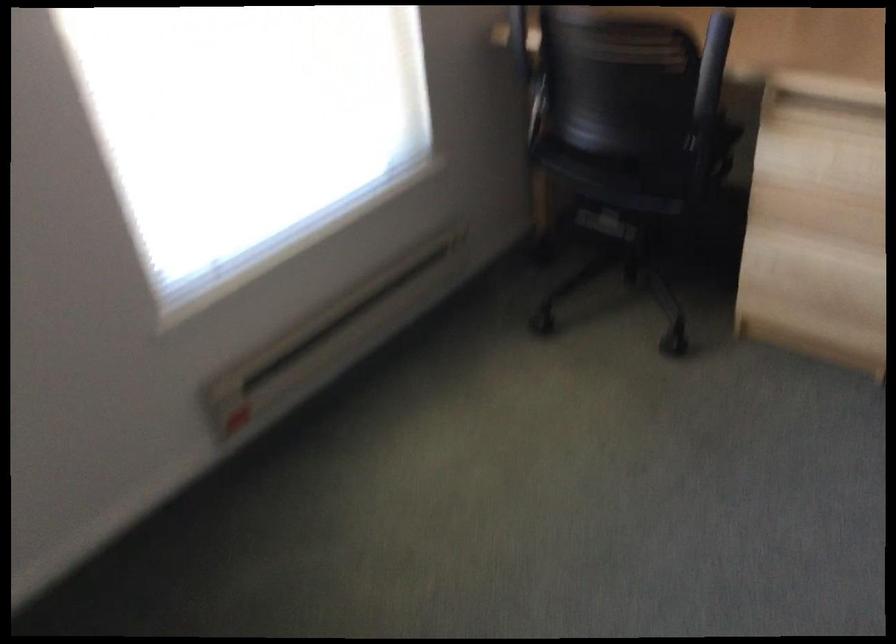
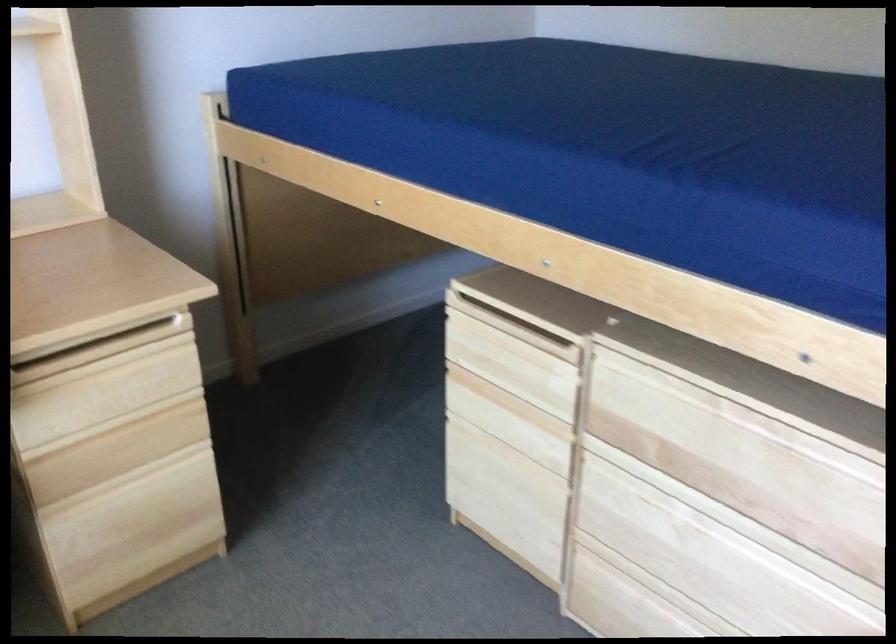
Question: The first image is from the beginning of the video and the second image is from the end. How did the camera likely rotate when shooting the video?

Choices:
 (A) Left
 (B) Right
 (C) Up
 (D) Down

Answer: (B)